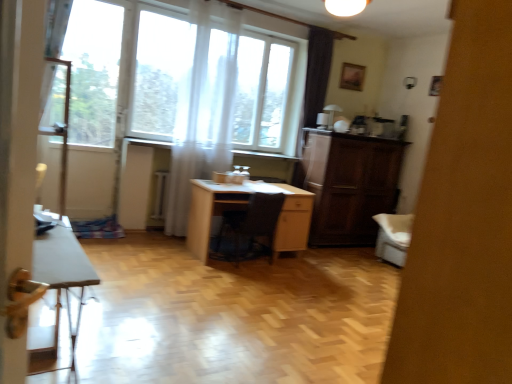
Question: Is point (111, 97) closer or farther from the camera than point (458, 329)?

Choices:
 (A) farther
 (B) closer

Answer: (A)

Question: Visually, is transparent fabric at left positioned to the left or to the right of white glossy cabinet at right?

Choices:
 (A) right
 (B) left

Answer: (B)

Question: Estimate the real-world distances between objects in this image. Which object is farther from the white glossy cabinet at right?

Choices:
 (A) transparent fabric at left
 (B) white glossy table at lower left
 (C) light wood desk at center
 (D) dark wood cabinet at right
 (E) white sheer curtain at upper center

Answer: (A)

Question: Which is nearer to the light wood desk at center?

Choices:
 (A) white sheer curtain at upper center
 (B) dark wood cabinet at right
 (C) black leather chair at center
 (D) white glossy cabinet at right
 (E) transparent fabric at left

Answer: (C)